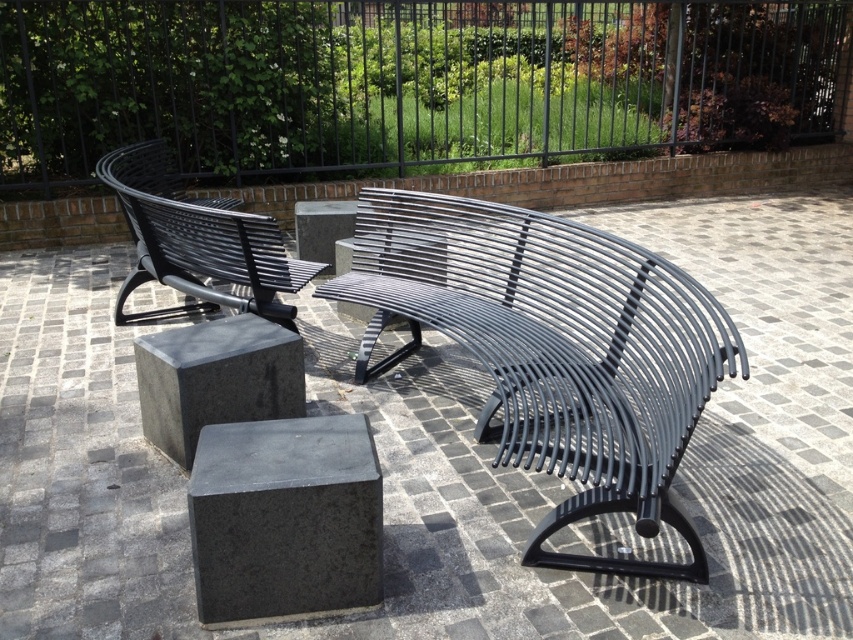
Does black metal fence at upper center have a larger size compared to gray concrete block at center?

Indeed, black metal fence at upper center has a larger size compared to gray concrete block at center.

Does point (180, 90) come closer to viewer compared to point (262, 451)?

That is False.

You are a GUI agent. You are given a task and a screenshot of the screen. Output one action in this format:
    pyautogui.click(x=<x>, y=<y>)
    Task: Click on the black metal fence at upper center
    
    Given the screenshot: What is the action you would take?
    pyautogui.click(x=405, y=81)

What do you see at coordinates (450, 458) in the screenshot? This screenshot has width=853, height=640. I see `gray granite cube at center` at bounding box center [450, 458].

Does gray granite cube at center appear on the left side of black metal bench at left?

Incorrect, gray granite cube at center is not on the left side of black metal bench at left.

The image size is (853, 640). What are the coordinates of `gray granite cube at center` in the screenshot? It's located at (450, 458).

Find the location of a particular element. gray granite cube at center is located at coordinates (450, 458).

Who is taller, gray concrete block at center or black metal bench at left?

With more height is black metal bench at left.

Where is `gray concrete block at center`? The width and height of the screenshot is (853, 640). gray concrete block at center is located at coordinates (285, 518).

Identify the location of gray concrete block at center. The image size is (853, 640). (285, 518).